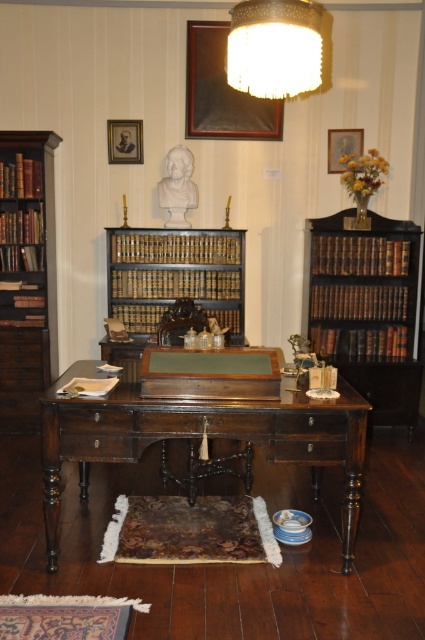
You are organizing a study session in the vintage study room and need to place a large book on the desk. Given that the dark wood desk at center and the brown wood drawer at left are both present, which object can accommodate the book based on their sizes?

The dark wood desk at center is larger in size than the brown wood drawer at left, so the dark wood desk at center can accommodate the large book.

You are organizing books in the study room. You have a brown leather book at center and a brown wooden bookshelf at right. Which object is located to the right of the other?

The brown wooden bookshelf at right is positioned on the right side of the brown leather book at center, so the bookshelf is to the right of the book.